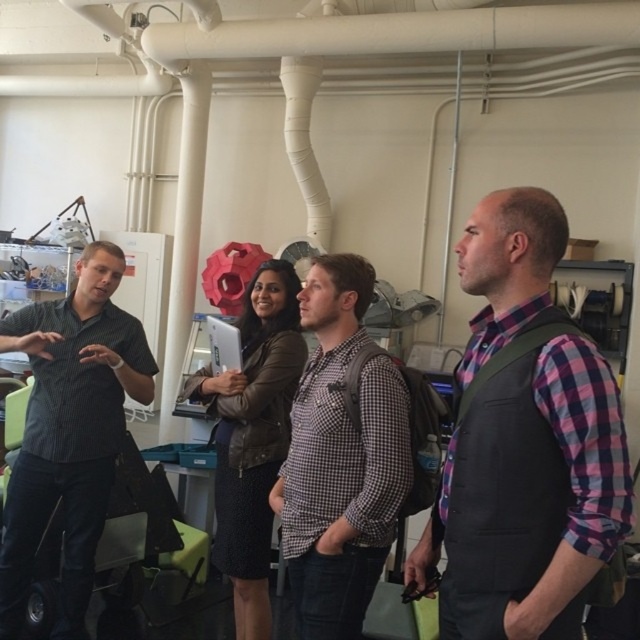
Who is positioned more to the left, checkered fabric shirt at center or dark gray button-down shirt at left?

Positioned to the left is dark gray button-down shirt at left.

Who is more forward, (348,452) or (86,531)?

Point (348,452) is in front.

Where is `checkered fabric shirt at center`? The width and height of the screenshot is (640, 640). checkered fabric shirt at center is located at coordinates (340, 458).

Can you confirm if plaid fabric shirt at center is smaller than checkered fabric shirt at center?

Actually, plaid fabric shirt at center might be larger than checkered fabric shirt at center.

Between point (532, 573) and point (300, 552), which one is positioned in front?

Positioned in front is point (532, 573).

The width and height of the screenshot is (640, 640). Find the location of `plaid fabric shirt at center`. plaid fabric shirt at center is located at coordinates (524, 442).

Is point (593, 528) in front of point (77, 394)?

Yes.

Find the location of a particular element. Image resolution: width=640 pixels, height=640 pixels. plaid fabric shirt at center is located at coordinates (524, 442).